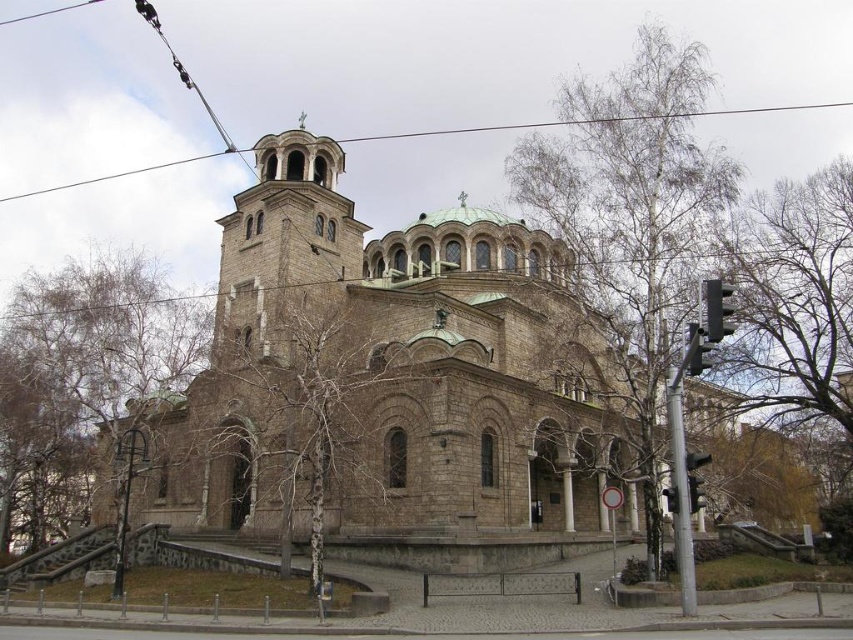
Question: Can you confirm if brown stone church at center is thinner than metallic wire at upper center?

Choices:
 (A) no
 (B) yes

Answer: (B)

Question: Does brown stone church at center appear over metallic wire at upper center?

Choices:
 (A) no
 (B) yes

Answer: (A)

Question: Which object is farther from the camera taking this photo?

Choices:
 (A) metallic wire at upper center
 (B) brown stone church at center

Answer: (A)

Question: Does brown stone church at center appear on the right side of metallic wire at upper center?

Choices:
 (A) yes
 (B) no

Answer: (A)

Question: Which point appears farthest from the camera in this image?

Choices:
 (A) (113, 173)
 (B) (386, 317)

Answer: (A)